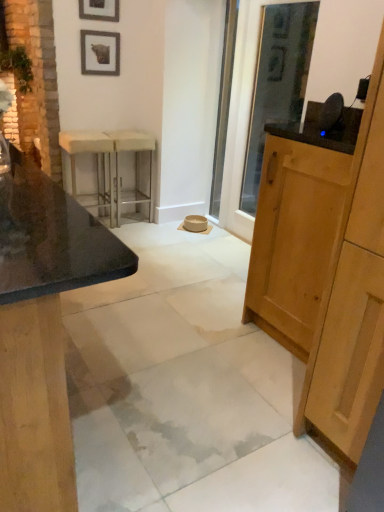
Question: From a real-world perspective, does metallic silver bar stool at center sit lower than matte black picture frame at upper left, marked as the 2th picture frame in a bottom-to-top arrangement?

Choices:
 (A) no
 (B) yes

Answer: (B)

Question: Can you confirm if metallic silver bar stool at center is positioned to the left of matte black picture frame at upper left, marked as the 1th picture frame in a top-to-bottom arrangement?

Choices:
 (A) no
 (B) yes

Answer: (A)

Question: Can you confirm if metallic silver bar stool at center is bigger than matte black picture frame at upper left, marked as the 2th picture frame in a bottom-to-top arrangement?

Choices:
 (A) no
 (B) yes

Answer: (B)

Question: Is metallic silver bar stool at center beside matte black picture frame at upper left, marked as the 2th picture frame in a bottom-to-top arrangement?

Choices:
 (A) yes
 (B) no

Answer: (B)

Question: Would you say metallic silver bar stool at center contains matte black picture frame at upper left, marked as the 1th picture frame in a top-to-bottom arrangement?

Choices:
 (A) yes
 (B) no

Answer: (B)

Question: Is metallic silver bar stool at center not inside matte black picture frame at upper left, marked as the 1th picture frame in a top-to-bottom arrangement?

Choices:
 (A) yes
 (B) no

Answer: (A)

Question: Is clear glass screen door at center smaller than white marble concrete at center?

Choices:
 (A) yes
 (B) no

Answer: (A)

Question: Is clear glass screen door at center bigger than white marble concrete at center?

Choices:
 (A) yes
 (B) no

Answer: (B)

Question: Can you confirm if clear glass screen door at center is shorter than white marble concrete at center?

Choices:
 (A) yes
 (B) no

Answer: (B)

Question: Is clear glass screen door at center facing towards white marble concrete at center?

Choices:
 (A) yes
 (B) no

Answer: (B)

Question: Is clear glass screen door at center to the right of white marble concrete at center from the viewer's perspective?

Choices:
 (A) no
 (B) yes

Answer: (B)

Question: From a real-world perspective, is clear glass screen door at center located beneath white marble concrete at center?

Choices:
 (A) no
 (B) yes

Answer: (A)

Question: Considering the relative sizes of white marble concrete at center and wooden picture frame at upper center, the 1th picture frame from the bottom, in the image provided, is white marble concrete at center smaller than wooden picture frame at upper center, the 1th picture frame from the bottom,?

Choices:
 (A) yes
 (B) no

Answer: (B)